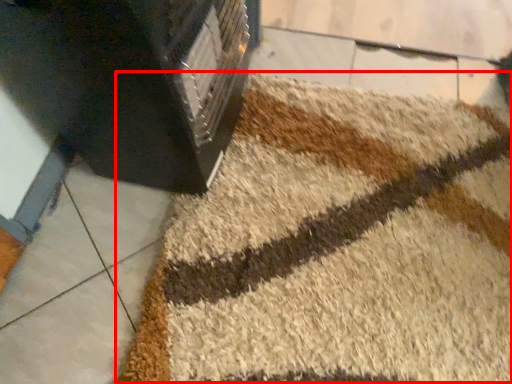
Question: Observing the image, what is the correct spatial positioning of bath mat (annotated by the red box) in reference to furniture?

Choices:
 (A) left
 (B) right

Answer: (B)